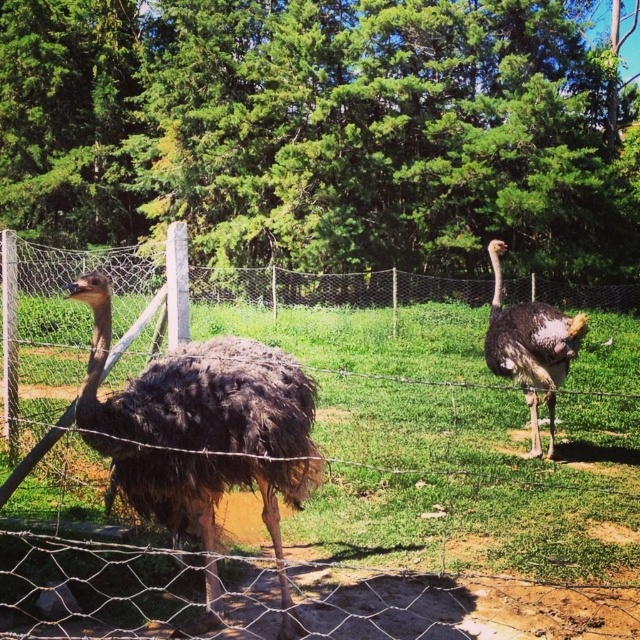
Does wire mesh fence at center have a greater height compared to dark brown feathered ostrich at right?

Indeed, wire mesh fence at center has a greater height compared to dark brown feathered ostrich at right.

Can you confirm if wire mesh fence at center is thinner than dark brown feathered ostrich at right?

No.

Who is more distant from viewer, (56,259) or (532,376)?

Positioned behind is point (56,259).

Where is `wire mesh fence at center`? This screenshot has width=640, height=640. wire mesh fence at center is located at coordinates (212, 284).

Can you confirm if brown feathered ostrich at left is positioned to the left of wire mesh fence at center?

Yes, brown feathered ostrich at left is to the left of wire mesh fence at center.

What do you see at coordinates (198, 392) in the screenshot? This screenshot has width=640, height=640. I see `brown feathered ostrich at left` at bounding box center [198, 392].

The image size is (640, 640). What do you see at coordinates (198, 392) in the screenshot? I see `brown feathered ostrich at left` at bounding box center [198, 392].

Image resolution: width=640 pixels, height=640 pixels. What are the coordinates of `brown feathered ostrich at left` in the screenshot? It's located at (198, 392).

Is brown feathered ostrich at left closer to camera compared to dark brown feathered ostrich at right?

Yes, it is.

Who is positioned more to the right, brown feathered ostrich at left or dark brown feathered ostrich at right?

From the viewer's perspective, dark brown feathered ostrich at right appears more on the right side.

This screenshot has width=640, height=640. Describe the element at coordinates (198, 392) in the screenshot. I see `brown feathered ostrich at left` at that location.

Image resolution: width=640 pixels, height=640 pixels. In order to click on brown feathered ostrich at left in this screenshot , I will do `click(198, 392)`.